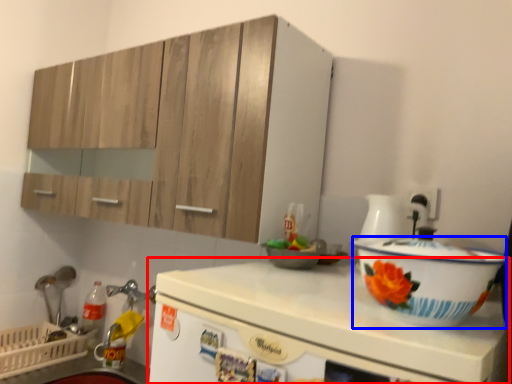
Question: Which of the following is the closest to the observer, countertop (highlighted by a red box) or basin (highlighted by a blue box)?

Choices:
 (A) countertop
 (B) basin

Answer: (A)